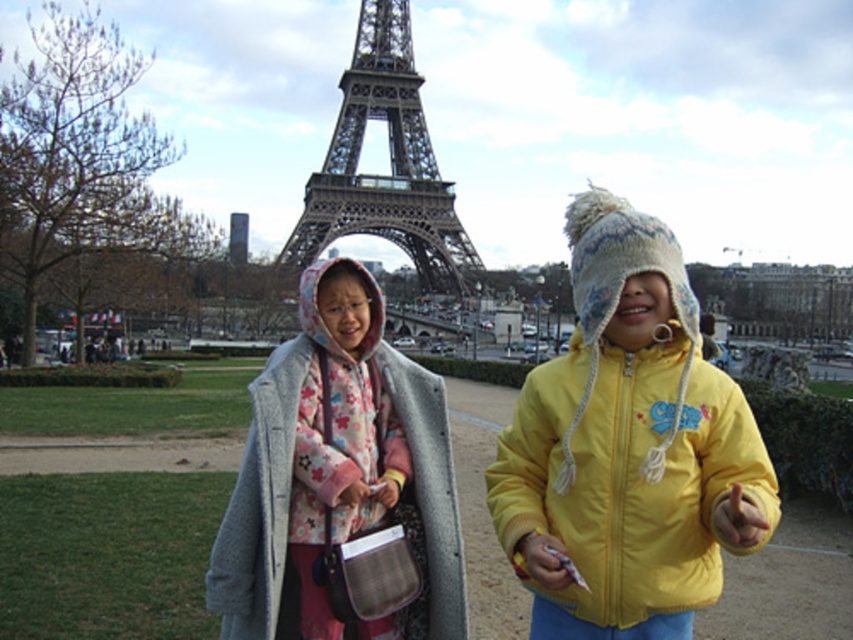
Between yellow fleece jacket at center and metallic structure at center, which one has less height?

metallic structure at center

Looking at this image, how far apart are yellow fleece jacket at center and metallic structure at center?

The distance of yellow fleece jacket at center from metallic structure at center is 46.99 meters.

What do you see at coordinates (627, 448) in the screenshot?
I see `yellow fleece jacket at center` at bounding box center [627, 448].

You are a GUI agent. You are given a task and a screenshot of the screen. Output one action in this format:
    pyautogui.click(x=<x>, y=<y>)
    Task: Click on the yellow fleece jacket at center
    The width and height of the screenshot is (853, 640).
    Given the screenshot: What is the action you would take?
    pyautogui.click(x=627, y=448)

Can you confirm if yellow fleece jacket at center is smaller than fluffy gray coat at center?

Yes.

Does yellow fleece jacket at center appear on the left side of fluffy gray coat at center?

No, yellow fleece jacket at center is not to the left of fluffy gray coat at center.

Find the location of `yellow fleece jacket at center`. yellow fleece jacket at center is located at coordinates (627, 448).

Is fluffy gray coat at center below metallic structure at center?

Yes, fluffy gray coat at center is below metallic structure at center.

Is point (292, 449) positioned before point (314, 218)?

Yes, point (292, 449) is closer to viewer.

You are a GUI agent. You are given a task and a screenshot of the screen. Output one action in this format:
    pyautogui.click(x=<x>, y=<y>)
    Task: Click on the fluffy gray coat at center
    
    Given the screenshot: What is the action you would take?
    pyautogui.click(x=334, y=468)